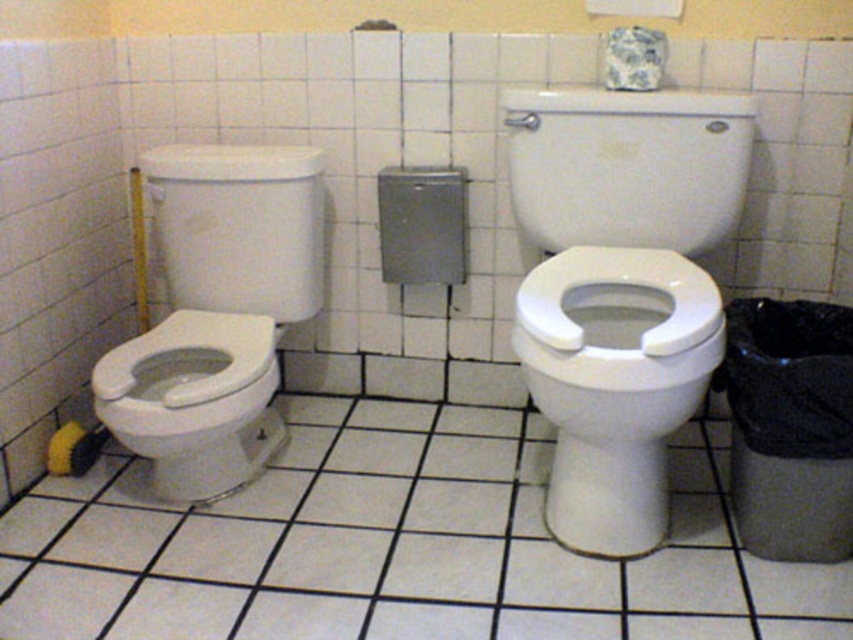
You are standing in a restroom with two white toilets side by side. You notice a point marked at coordinates (218, 314). Which toilet is located at that point? The options are the white glossy toilet at left and the other toilet.

The white glossy toilet at left is located at point (218, 314).

Consider the image. You are a maintenance worker inspecting the restroom. You need to check both the white glossy toilet at left and the blue and white ceramic toilet paper at upper center. Which object should you check first if you want to start with the one closer to you?

You should check the white glossy toilet at left first because it is closer to the viewer than the blue and white ceramic toilet paper at upper center.

You are standing in the restroom and need to reach both the blue and white ceramic toilet paper at upper center and the yellow fabric toilet paper at lower left. Which one will you grab first if you want to pick up the one closer to you?

You will grab the blue and white ceramic toilet paper at upper center first because it is closer to you than the yellow fabric toilet paper at lower left.